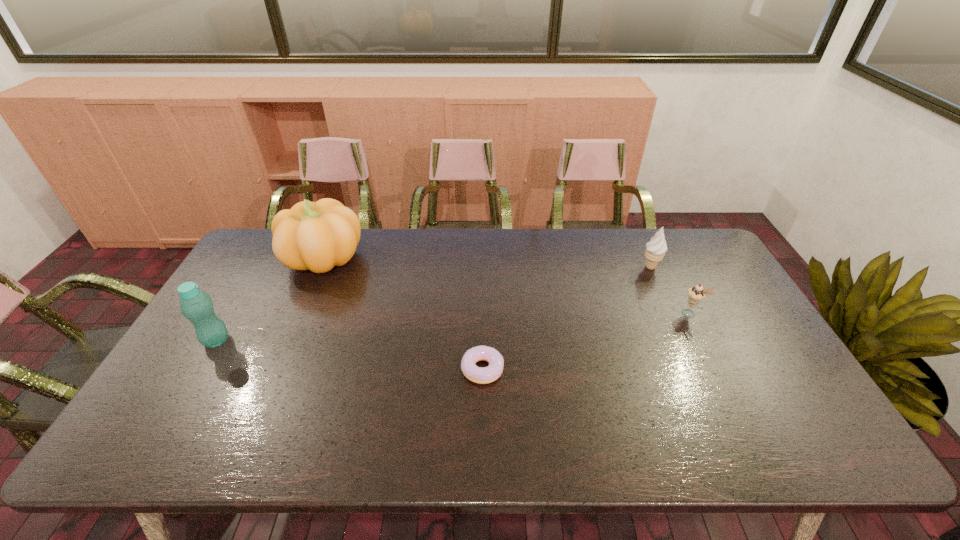
Identify the location of free point located at the front cap of the second nearest object. This screenshot has height=540, width=960. (276, 341).

You are a GUI agent. You are given a task and a screenshot of the screen. Output one action in this format:
    pyautogui.click(x=<x>, y=<y>)
    Task: Click on the free spot located on the front-facing side of the farther icecream
    The height and width of the screenshot is (540, 960).
    Given the screenshot: What is the action you would take?
    pyautogui.click(x=689, y=352)

Locate an element on the screen. free space located 0.300m on the left of the third farthest object is located at coordinates (579, 313).

Where is `vacant space located on the right of the doughnut`? Image resolution: width=960 pixels, height=540 pixels. vacant space located on the right of the doughnut is located at coordinates (594, 369).

Identify the location of pumpkin positioned at the far edge. This screenshot has width=960, height=540. point(316,236).

Where is `icecream located at the far edge`? icecream located at the far edge is located at coordinates (655, 249).

The image size is (960, 540). I want to click on pumpkin located at the left edge, so click(x=316, y=236).

Identify the location of water bottle located in the left edge section of the desktop. (196, 306).

At what (x,y) coordinates should I click in order to perform the action: click on object that is at the right edge. Please return your answer as a coordinate pair (x, y). The height and width of the screenshot is (540, 960). Looking at the image, I should click on (696, 294).

Find the location of a particular element. The image size is (960, 540). object that is at the far left corner is located at coordinates (316, 236).